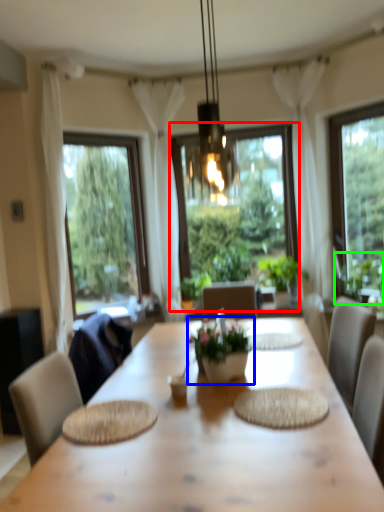
Question: Which is nearer to the window (highlighted by a red box)? houseplant (highlighted by a blue box) or plant (highlighted by a green box).

Choices:
 (A) houseplant
 (B) plant

Answer: (B)